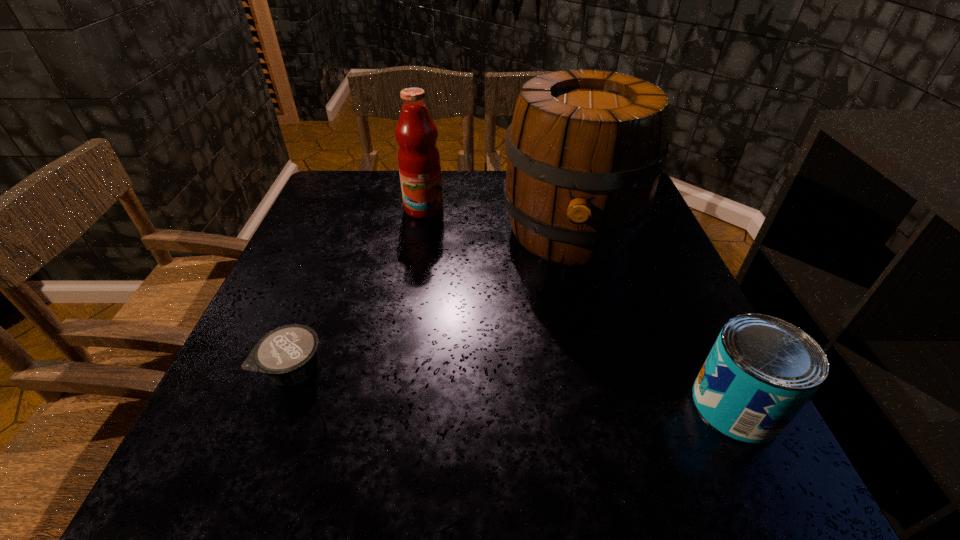
Find the location of a particular element. object that is positioned at the near left corner is located at coordinates [x=288, y=355].

Locate an element on the screen. object at the far right corner is located at coordinates (585, 149).

You are a GUI agent. You are given a task and a screenshot of the screen. Output one action in this format:
    pyautogui.click(x=<x>, y=<y>)
    Task: Click on the object that is at the near right corner
    Image resolution: width=960 pixels, height=540 pixels.
    Given the screenshot: What is the action you would take?
    pyautogui.click(x=761, y=371)

You are a GUI agent. You are given a task and a screenshot of the screen. Output one action in this format:
    pyautogui.click(x=<x>, y=<y>)
    Task: Click on the free space at the near edge of the desktop
    The height and width of the screenshot is (540, 960).
    Given the screenshot: What is the action you would take?
    pyautogui.click(x=506, y=409)

This screenshot has width=960, height=540. In order to click on free space at the left edge of the desktop in this screenshot , I will do [342, 290].

Where is `free space at the right edge of the desktop`? free space at the right edge of the desktop is located at coordinates (658, 361).

Where is `vacant space at the far left corner of the desktop`? vacant space at the far left corner of the desktop is located at coordinates (368, 180).

I want to click on free space between the third object from right to left and the can, so click(x=580, y=307).

Locate an element on the screen. The image size is (960, 540). vacant point located between the third tallest object and the fruit juice is located at coordinates (580, 307).

In order to click on empty space that is in between the shortest object and the cider in this screenshot , I will do `click(433, 300)`.